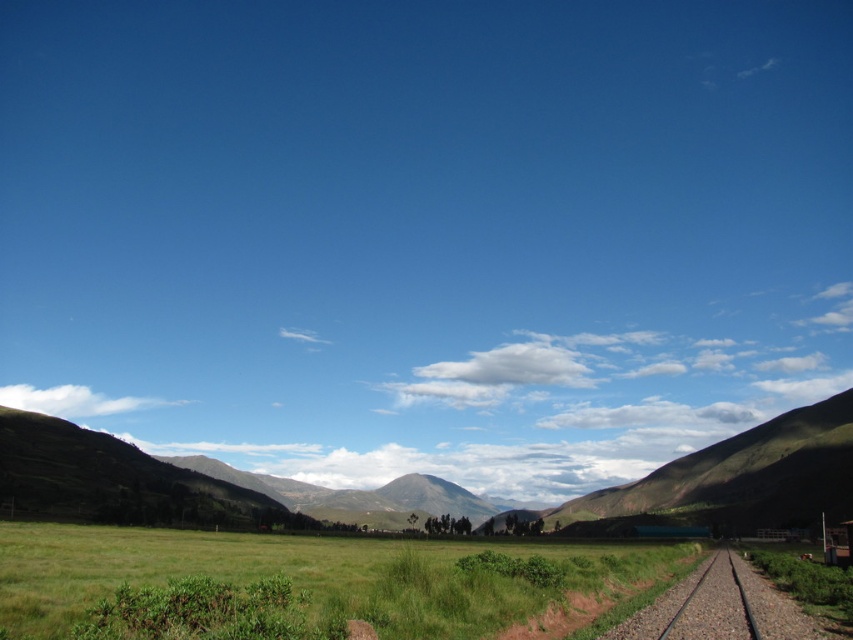
Question: Does green grassy field at lower center have a lesser width compared to smooth metal train track at lower right?

Choices:
 (A) yes
 (B) no

Answer: (B)

Question: From the image, what is the correct spatial relationship of green grassy field at lower center in relation to smooth metal train track at lower right?

Choices:
 (A) right
 (B) left

Answer: (B)

Question: Which of the following is the closest to the observer?

Choices:
 (A) (398, 595)
 (B) (715, 637)

Answer: (B)

Question: Does green grassy field at lower center come in front of smooth metal train track at lower right?

Choices:
 (A) no
 (B) yes

Answer: (B)